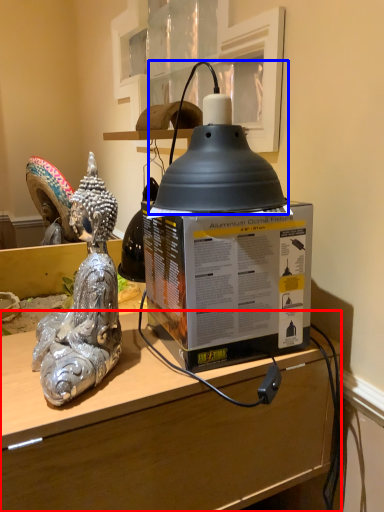
Question: Which of the following is the farthest to the observer, desk (highlighted by a red box) or oil lamp (highlighted by a blue box)?

Choices:
 (A) desk
 (B) oil lamp

Answer: (B)